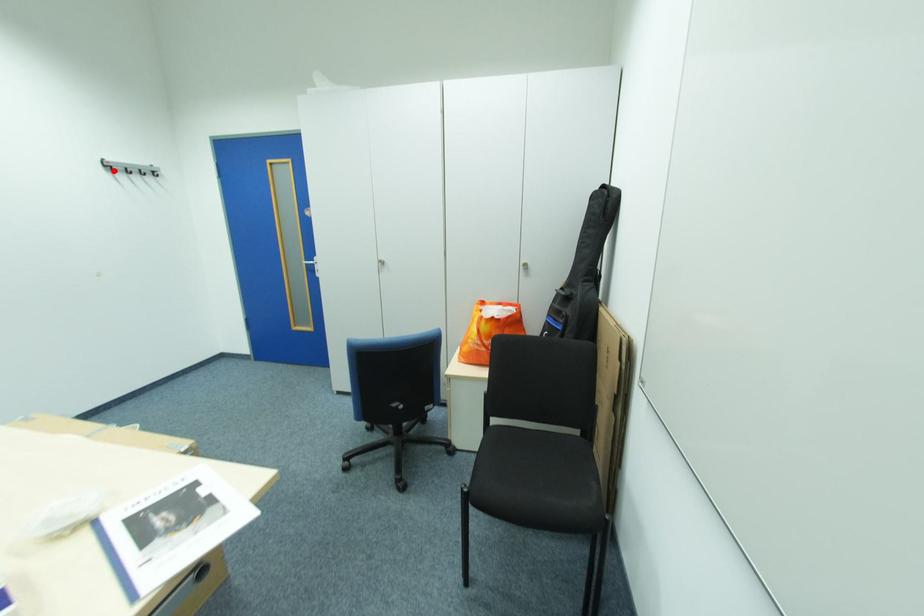
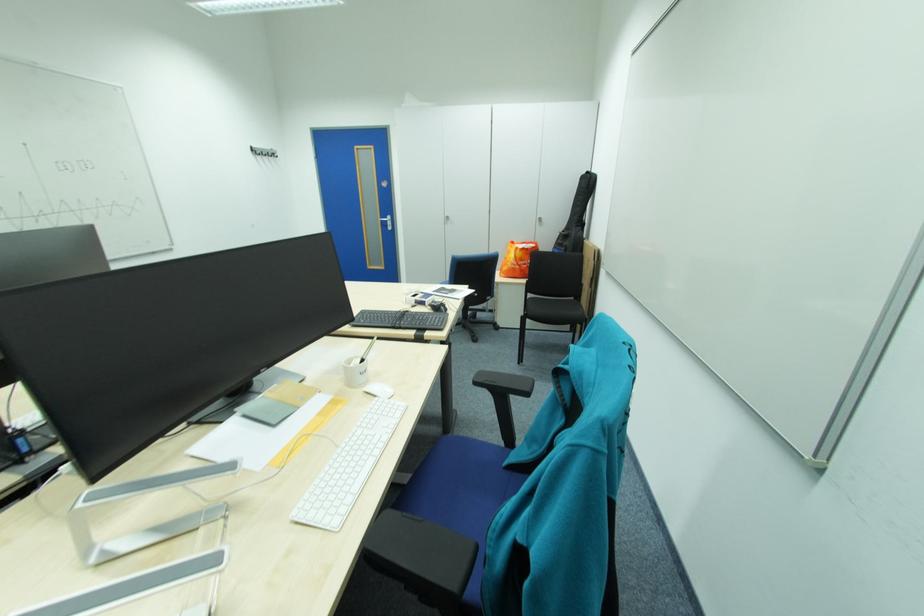
The point at the highlighted location is marked in the first image. Where is the corresponding point in the second image?

(262, 153)